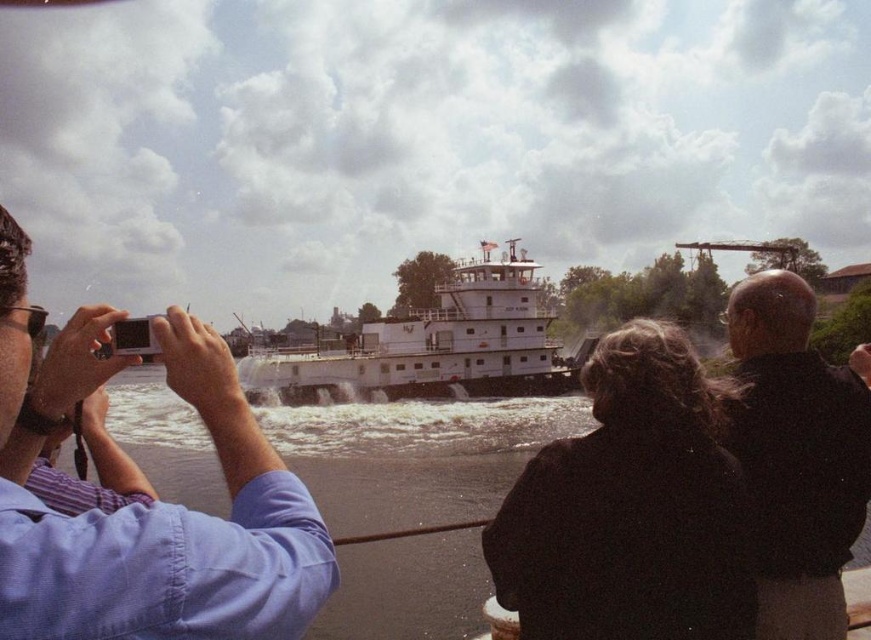
You are standing on the riverbank and see the matte white camera at left and the white matte tugboat at center. Which object is closer to your left side?

The matte white camera at left is closer to your left side because it is positioned to the left of the white matte tugboat at center.

You have a matte white camera at left and a black leather jacket at upper right in your view. Which object is smaller?

The matte white camera at left is smaller than the black leather jacket at upper right.

You are standing at the scene and want to take a photo of the barge using the matte white camera at left. Can you reach it without moving more than 30 meters?

The matte white camera at left is 33.73 meters away from viewer, so you cannot reach it without moving more than 30 meters.